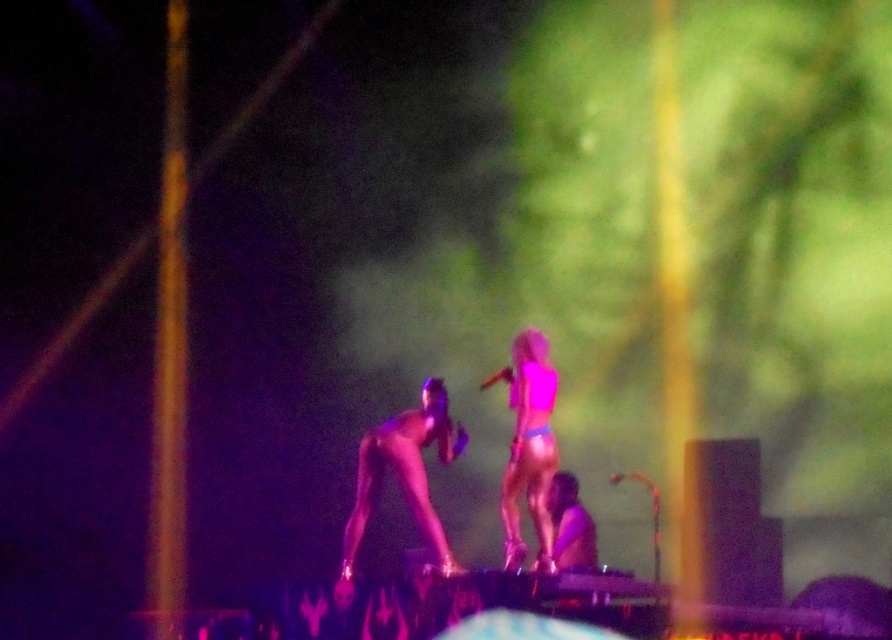
Who is positioned more to the right, shiny metallic pole at center or pink matte bikini at center?

From the viewer's perspective, pink matte bikini at center appears more on the right side.

Looking at this image, is shiny metallic pole at center positioned before pink matte bikini at center?

Yes, shiny metallic pole at center is in front of pink matte bikini at center.

Locate an element on the screen. shiny metallic pole at center is located at coordinates (403, 474).